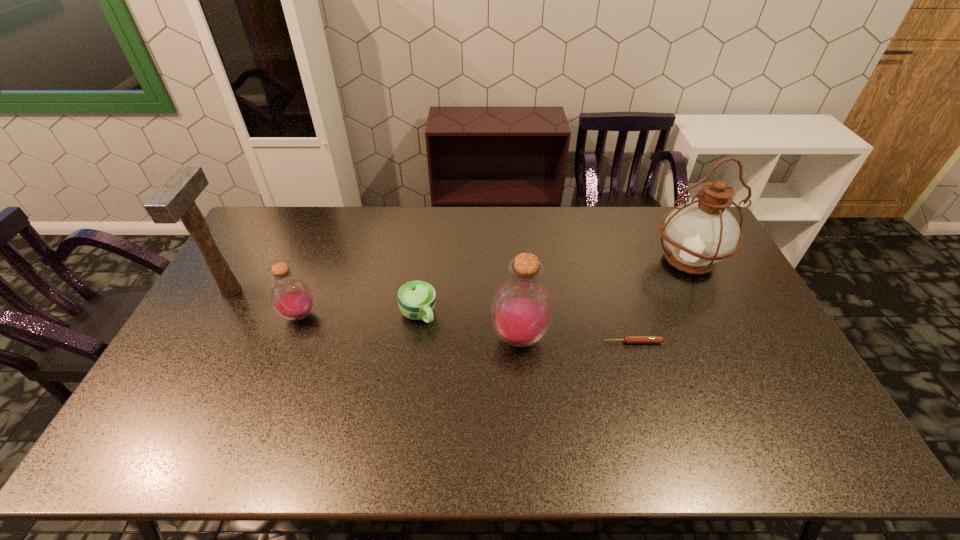
Find the location of `the third shortest object`. the third shortest object is located at coordinates (291, 298).

Identify the location of the left bottle. The image size is (960, 540). (291, 298).

At what (x,y) coordinates should I click in order to perform the action: click on the fourth shortest object. Please return your answer as a coordinate pair (x, y). The image size is (960, 540). Looking at the image, I should click on (521, 312).

Find the location of `the right bottle`. the right bottle is located at coordinates (521, 312).

At what (x,y) coordinates should I click in order to perform the action: click on the rightmost object. Please return your answer as a coordinate pair (x, y). Looking at the image, I should click on (698, 234).

This screenshot has width=960, height=540. I want to click on mallet, so click(x=175, y=200).

Locate an element on the screen. the shortest object is located at coordinates (627, 339).

Locate an element on the screen. sausage is located at coordinates (627, 339).

This screenshot has height=540, width=960. In order to click on cup in this screenshot , I will do `click(416, 299)`.

This screenshot has height=540, width=960. Identify the location of the third object from left to right. (416, 299).